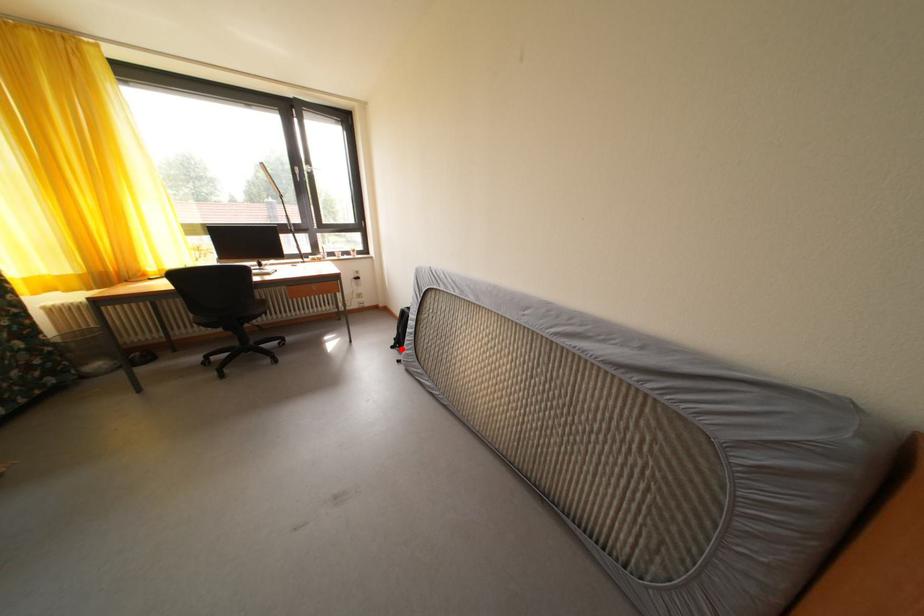
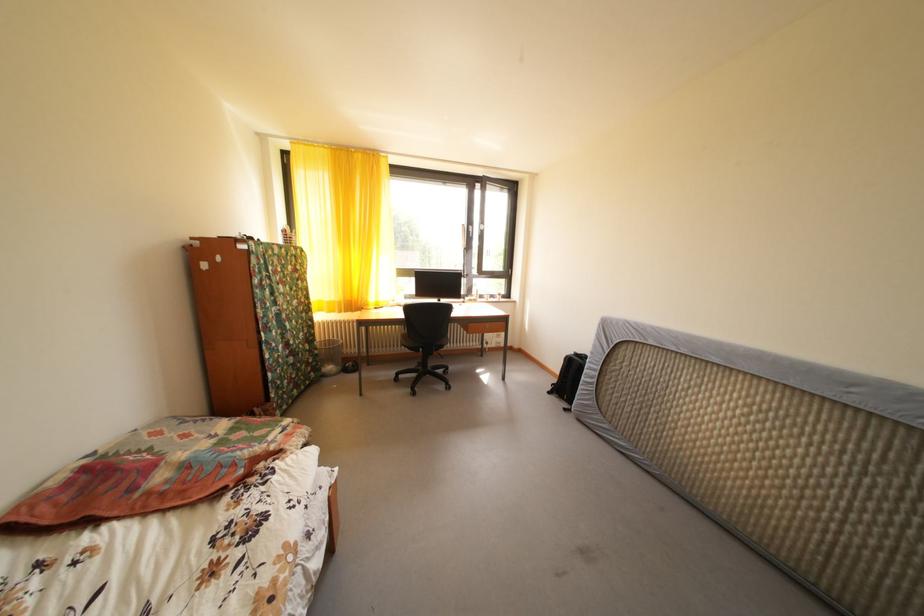
Question: I am providing you with two images of the same scene from different viewpoints. Image1 has a red point marked. In image2, the corresponding 3D location appears at what relative position? Reply with the corresponding letter.

Choices:
 (A) Closer
 (B) Farther

Answer: (A)